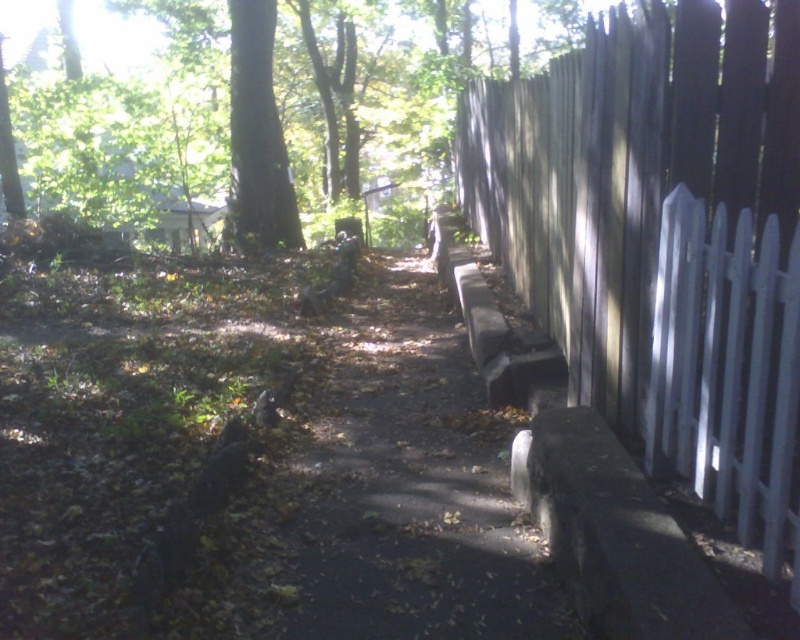
Question: Is wooden picket fence at right bigger than dark brown wood tree at upper center?

Choices:
 (A) no
 (B) yes

Answer: (B)

Question: Which of the following is the farthest from the observer?

Choices:
 (A) dark brown wood tree at upper center
 (B) wooden picket fence at right

Answer: (A)

Question: Estimate the real-world distances between objects in this image. Which object is closer to the brown dirt path at center?

Choices:
 (A) dark brown wood tree at upper center
 (B) wooden picket fence at right

Answer: (B)

Question: Is wooden picket fence at right wider than brown dirt path at center?

Choices:
 (A) no
 (B) yes

Answer: (A)

Question: Which object is farther from the camera taking this photo?

Choices:
 (A) dark brown wood tree at upper center
 (B) wooden picket fence at right

Answer: (A)

Question: Is wooden picket fence at right below dark brown wood tree at upper center?

Choices:
 (A) no
 (B) yes

Answer: (B)